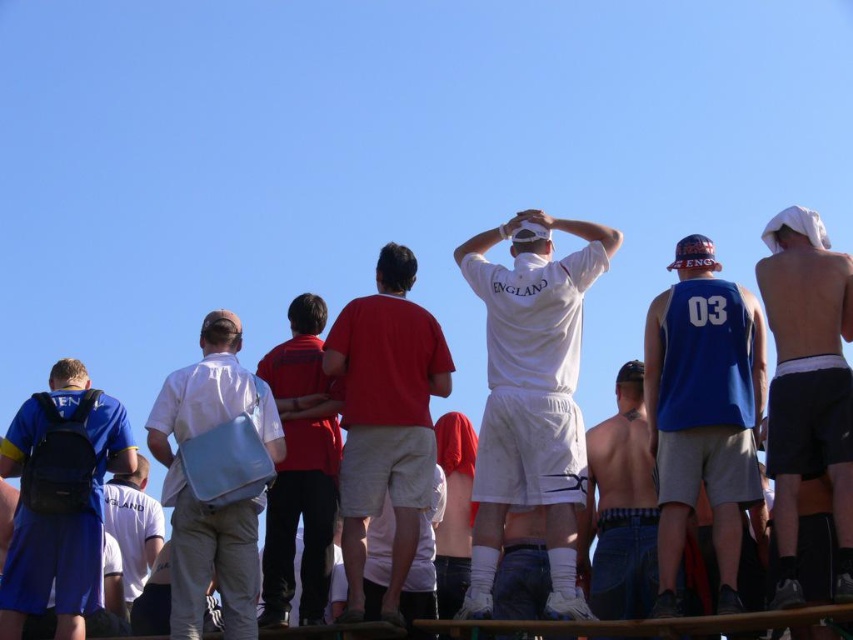
Measure the distance from blue jersey at center to blue fabric backpack at left.

52.60 meters

Who is more forward, (x=711, y=365) or (x=71, y=605)?

Positioned in front is point (x=711, y=365).

Locate an element on the screen. blue jersey at center is located at coordinates (703, 412).

Who is positioned more to the right, white matte shirt at center or white cotton shirt at center?

Positioned to the right is white matte shirt at center.

The image size is (853, 640). I want to click on white matte shirt at center, so click(x=531, y=396).

I want to click on white matte shirt at center, so click(x=531, y=396).

Identify the location of red cotton shirt at center. (386, 419).

Is red cotton shirt at center smaller than white cotton shirt at center?

No, red cotton shirt at center is not smaller than white cotton shirt at center.

The width and height of the screenshot is (853, 640). What do you see at coordinates (386, 419) in the screenshot?
I see `red cotton shirt at center` at bounding box center [386, 419].

The image size is (853, 640). In order to click on red cotton shirt at center in this screenshot , I will do `click(386, 419)`.